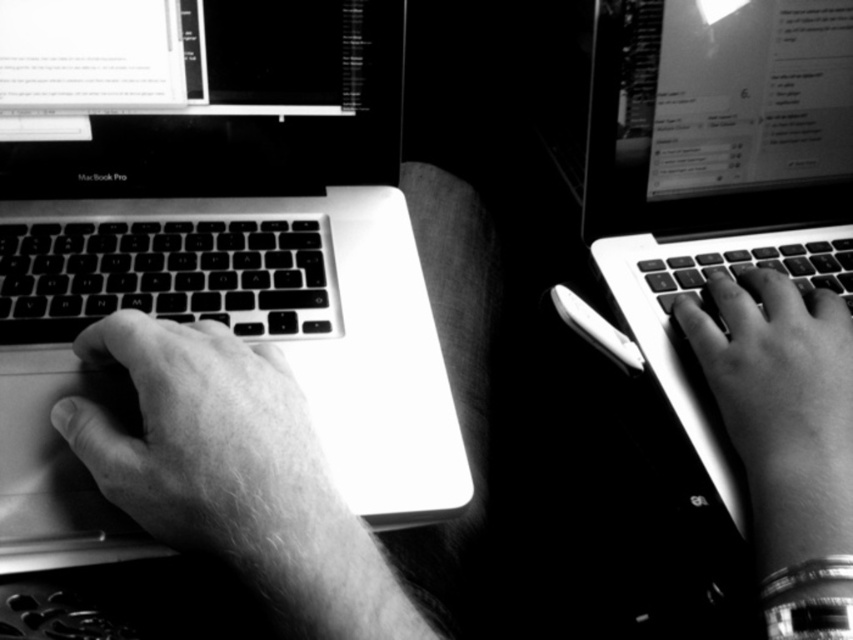
In the scene, there are two people working on their laptops. The left person has their hand resting on a point marked as point (167, 275). What object is located at that point?

The point (167, 275) corresponds to the black matte keyboard at left.

You are a photographer analyzing the composition of this black and white photo. You notice the smooth skin hand at center and the metallic keyboard at right. Which object occupies more vertical space in the image?

The metallic keyboard at right is taller than the smooth skin hand at center, so it occupies more vertical space.

You are designing a new ergonomic wrist rest that needs to fit between the smooth skin hand at left and the black matte keyboard at left. Given the hand is narrower than the keyboard, will the wrist rest need to be wider than the keyboard to accommodate both?

The smooth skin hand at left is narrower than the black matte keyboard at left. Therefore, the wrist rest should be designed to match or slightly exceed the keyboard width to comfortably support both the hand and keyboard area.